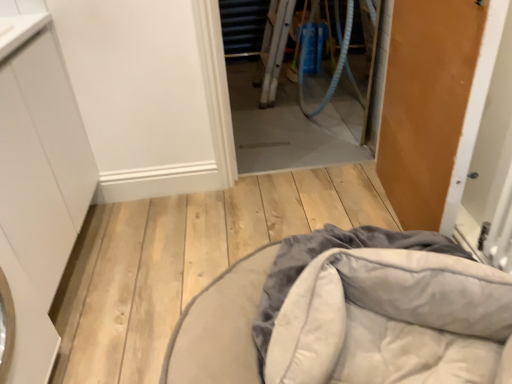
Question: Should I look upward or downward to see transparent plastic screen door at center?

Choices:
 (A) down
 (B) up

Answer: (B)

Question: Is the position of wooden door at right more distant than that of transparent plastic screen door at center?

Choices:
 (A) yes
 (B) no

Answer: (B)

Question: From the image's perspective, does wooden door at right appear higher than transparent plastic screen door at center?

Choices:
 (A) yes
 (B) no

Answer: (B)

Question: Would you say wooden door at right is outside transparent plastic screen door at center?

Choices:
 (A) yes
 (B) no

Answer: (A)

Question: Would you consider wooden door at right to be distant from transparent plastic screen door at center?

Choices:
 (A) yes
 (B) no

Answer: (A)

Question: From the image's perspective, is wooden door at right beneath transparent plastic screen door at center?

Choices:
 (A) no
 (B) yes

Answer: (B)

Question: Is wooden door at right smaller than transparent plastic screen door at center?

Choices:
 (A) yes
 (B) no

Answer: (A)

Question: Does transparent plastic screen door at center have a lesser height compared to blue rubber garden hose at center?

Choices:
 (A) yes
 (B) no

Answer: (A)

Question: From the image's perspective, is transparent plastic screen door at center located beneath blue rubber garden hose at center?

Choices:
 (A) yes
 (B) no

Answer: (A)

Question: Is transparent plastic screen door at center bigger than blue rubber garden hose at center?

Choices:
 (A) no
 (B) yes

Answer: (A)

Question: Is transparent plastic screen door at center oriented away from blue rubber garden hose at center?

Choices:
 (A) yes
 (B) no

Answer: (A)

Question: Can you confirm if transparent plastic screen door at center is positioned to the right of blue rubber garden hose at center?

Choices:
 (A) yes
 (B) no

Answer: (B)

Question: Considering the relative sizes of transparent plastic screen door at center and blue rubber garden hose at center in the image provided, is transparent plastic screen door at center thinner than blue rubber garden hose at center?

Choices:
 (A) yes
 (B) no

Answer: (A)

Question: Does transparent plastic screen door at center have a lesser width compared to white matte cabinet at left?

Choices:
 (A) no
 (B) yes

Answer: (B)